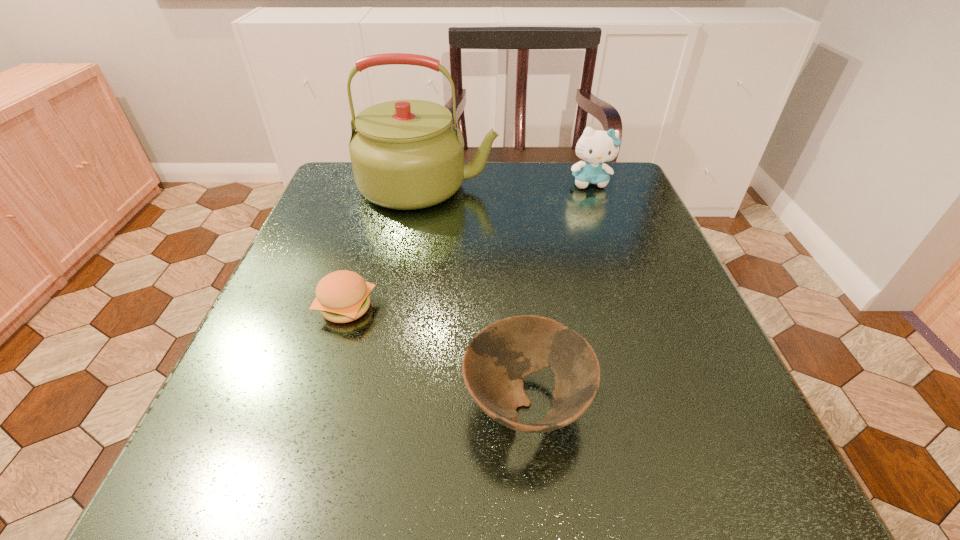
Locate an element on the screen. The width and height of the screenshot is (960, 540). vacant position in the image that satisfies the following two spatial constraints: 1. on the back side of the nearest object; 2. at the spout of the kettle is located at coordinates (507, 186).

Where is `free space that satisfies the following two spatial constraints: 1. on the face of the kitten; 2. at the spout of the kettle`? The height and width of the screenshot is (540, 960). free space that satisfies the following two spatial constraints: 1. on the face of the kitten; 2. at the spout of the kettle is located at coordinates (591, 186).

The image size is (960, 540). What are the coordinates of `free space that satisfies the following two spatial constraints: 1. at the spout of the third tallest object; 2. on the left side of the kettle` in the screenshot? It's located at [392, 403].

Locate an element on the screen. vacant space that satisfies the following two spatial constraints: 1. at the spout of the tallest object; 2. on the front side of the shortest object is located at coordinates (407, 308).

You are a GUI agent. You are given a task and a screenshot of the screen. Output one action in this format:
    pyautogui.click(x=<x>, y=<y>)
    Task: Click on the vacant space that satisfies the following two spatial constraints: 1. on the back side of the third tallest object; 2. at the spout of the kettle
    The width and height of the screenshot is (960, 540).
    Given the screenshot: What is the action you would take?
    pyautogui.click(x=507, y=186)